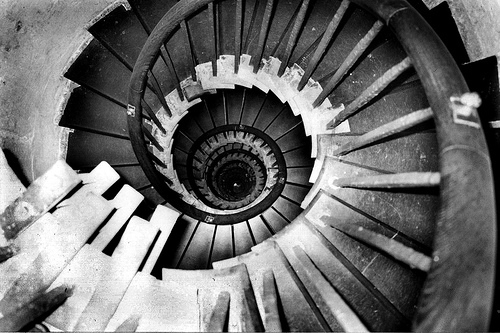
Image resolution: width=500 pixels, height=333 pixels. Identify the location of wall. pyautogui.click(x=50, y=25), pyautogui.click(x=476, y=20).